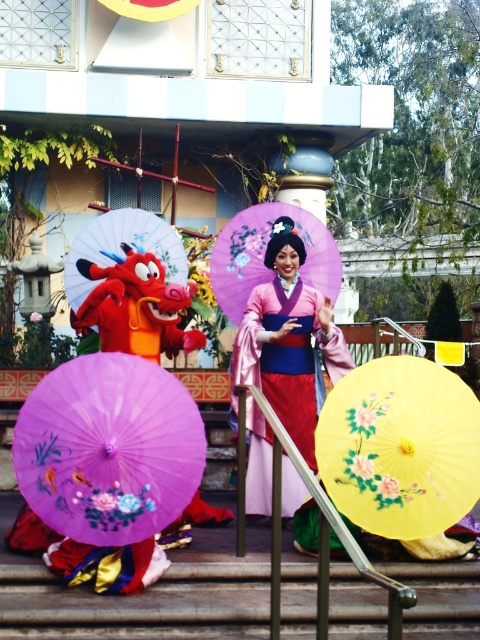
Question: Which point is closer to the camera?

Choices:
 (A) yellow paper umbrella at center
 (B) purple painted parasol at center
 (C) purple paper umbrella at center

Answer: (C)

Question: Which point is farther from the camera taking this photo?

Choices:
 (A) (164, 260)
 (B) (173, 392)

Answer: (A)

Question: Among these objects, which one is farthest from the camera?

Choices:
 (A) purple paper umbrella at center
 (B) pink satin kimono at center
 (C) purple painted parasol at center
 (D) yellow paper umbrella at center

Answer: (C)

Question: Is purple paper umbrella at center smaller than pink satin kimono at center?

Choices:
 (A) no
 (B) yes

Answer: (B)

Question: Can you confirm if pink satin kimono at center is positioned above purple painted parasol at center?

Choices:
 (A) no
 (B) yes

Answer: (A)

Question: Can you confirm if purple paper umbrella at center is positioned to the left of yellow paper umbrella at center?

Choices:
 (A) yes
 (B) no

Answer: (A)